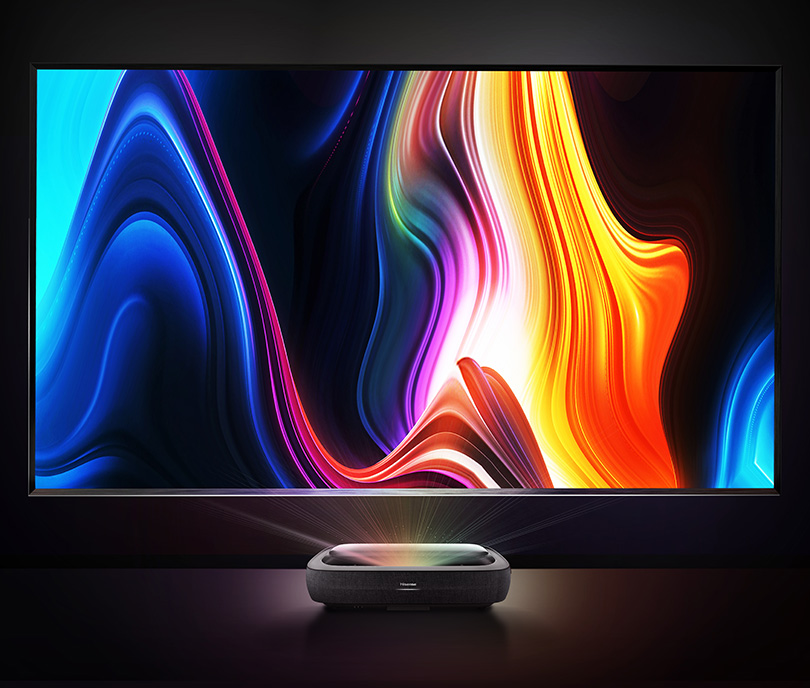
What are the coordinates of `tv image` in the screenshot? It's located at (116, 495), (668, 83).